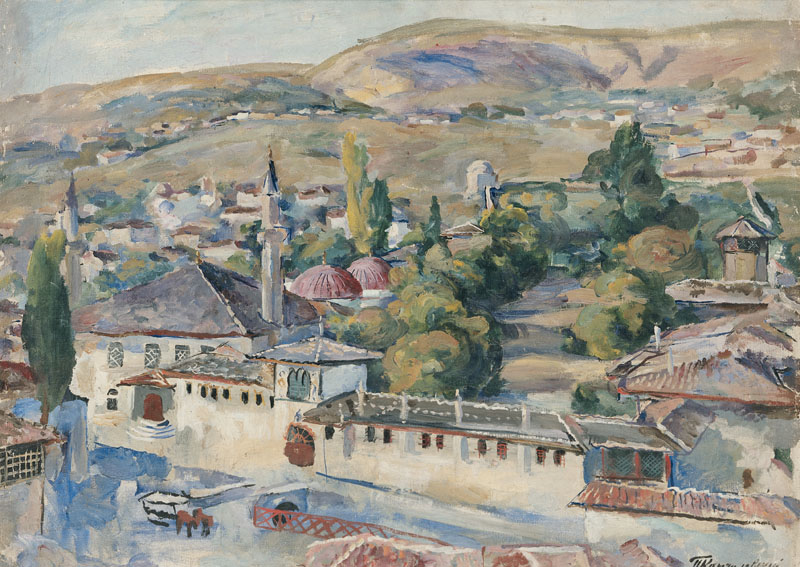
You are a GUI agent. You are given a task and a screenshot of the screen. Output one action in this format:
    pyautogui.click(x=<x>, y=<y>)
    Task: Click on the door
    This screenshot has width=800, height=567.
    Given the screenshot: What is the action you would take?
    pyautogui.click(x=152, y=416)